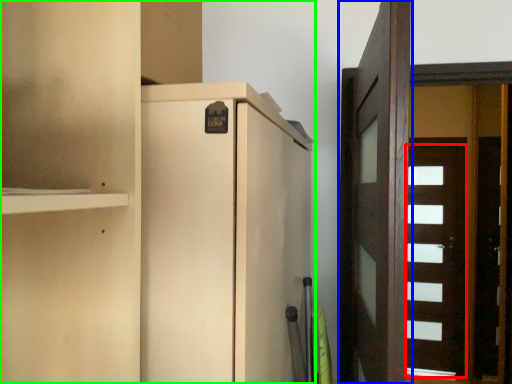
Question: Estimate the real-world distances between objects in this image. Which object is farther from door (highlighted by a red box), door (highlighted by a blue box) or cupboard (highlighted by a green box)?

Choices:
 (A) door
 (B) cupboard

Answer: (B)